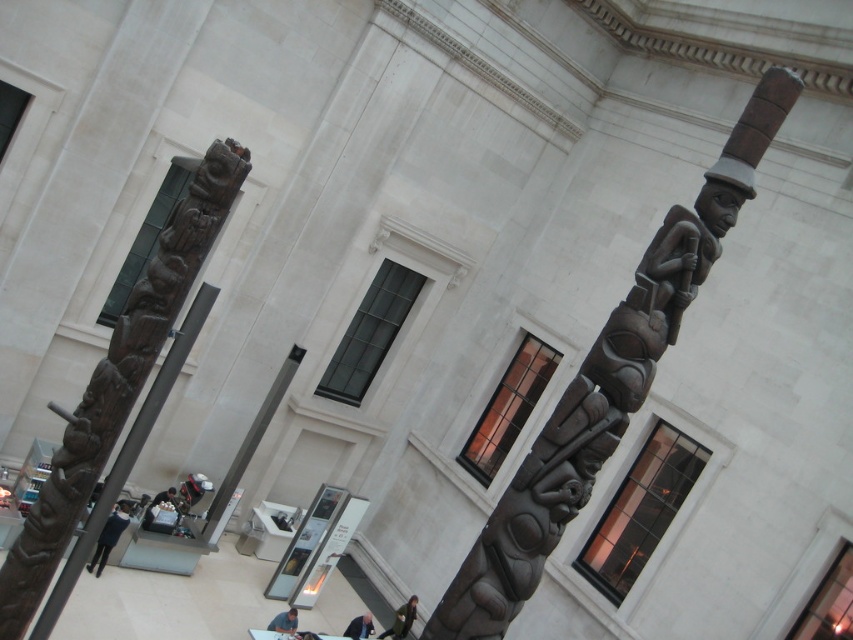
Who is taller, dark brown wood totem pole at left or dark blue jeans at lower left?

Standing taller between the two is dark brown wood totem pole at left.

Does dark brown wood totem pole at left have a smaller size compared to dark blue jeans at lower left?

Incorrect, dark brown wood totem pole at left is not smaller in size than dark blue jeans at lower left.

You are a GUI agent. You are given a task and a screenshot of the screen. Output one action in this format:
    pyautogui.click(x=<x>, y=<y>)
    Task: Click on the dark brown wood totem pole at left
    
    Given the screenshot: What is the action you would take?
    pyautogui.click(x=117, y=381)

Between dark brown wood totem pole at left and green fabric jacket at lower center, which one is positioned higher?

dark brown wood totem pole at left is above.

Does point (106, 444) lie in front of point (399, 627)?

Yes, point (106, 444) is in front of point (399, 627).

You are a GUI agent. You are given a task and a screenshot of the screen. Output one action in this format:
    pyautogui.click(x=<x>, y=<y>)
    Task: Click on the dark brown wood totem pole at left
    Image resolution: width=853 pixels, height=640 pixels.
    Given the screenshot: What is the action you would take?
    pyautogui.click(x=117, y=381)

Where is `dark brown wood totem pole at left`? This screenshot has width=853, height=640. dark brown wood totem pole at left is located at coordinates (117, 381).

Does bronze textured totem pole at center have a greater width compared to dark brown leather jacket at lower left?

Indeed, bronze textured totem pole at center has a greater width compared to dark brown leather jacket at lower left.

Does bronze textured totem pole at center have a lesser width compared to dark brown leather jacket at lower left?

No.

This screenshot has width=853, height=640. Describe the element at coordinates (606, 385) in the screenshot. I see `bronze textured totem pole at center` at that location.

Locate an element on the screen. bronze textured totem pole at center is located at coordinates (606, 385).